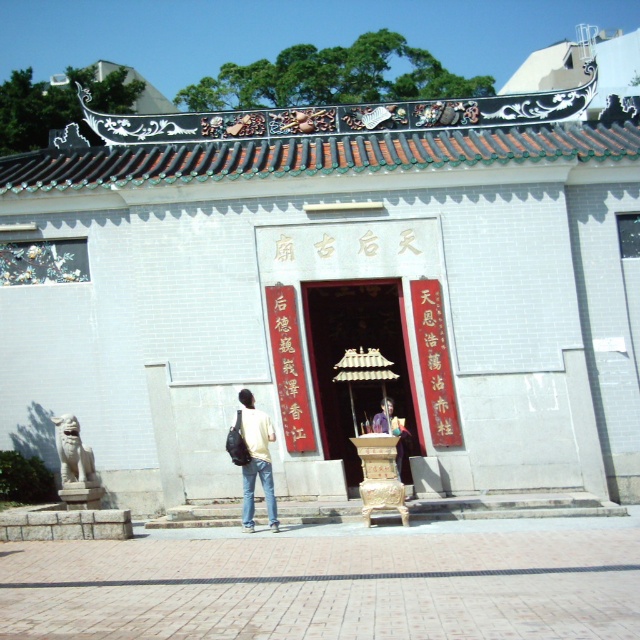
Question: Is smooth wooden altar at center below light yellow t-shirt at center?

Choices:
 (A) no
 (B) yes

Answer: (A)

Question: Estimate the real-world distances between objects in this image. Which object is farther from the smooth wooden altar at center?

Choices:
 (A) dark blue shirt at center
 (B) light yellow t-shirt at center

Answer: (B)

Question: Which of the following is the closest to the observer?

Choices:
 (A) light yellow t-shirt at center
 (B) dark blue shirt at center
 (C) smooth wooden altar at center

Answer: (A)

Question: Which object is positioned farthest from the dark blue shirt at center?

Choices:
 (A) smooth wooden altar at center
 (B) light yellow t-shirt at center

Answer: (B)

Question: Is light yellow t-shirt at center bigger than dark blue shirt at center?

Choices:
 (A) no
 (B) yes

Answer: (B)

Question: Is smooth wooden altar at center to the left of dark blue shirt at center from the viewer's perspective?

Choices:
 (A) no
 (B) yes

Answer: (B)